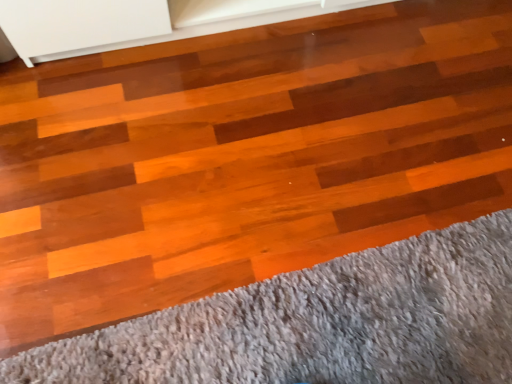
Find the location of a particular element. This screenshot has height=384, width=512. free spot below gray shaggy rug at lower right (from a real-world perspective) is located at coordinates (324, 319).